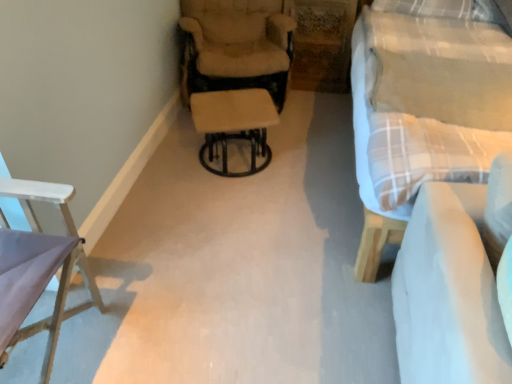
I want to click on free space that is in between beige fabric chair at center, placed as the second chair when sorted from bottom to top, and black metal stool at center, so click(271, 147).